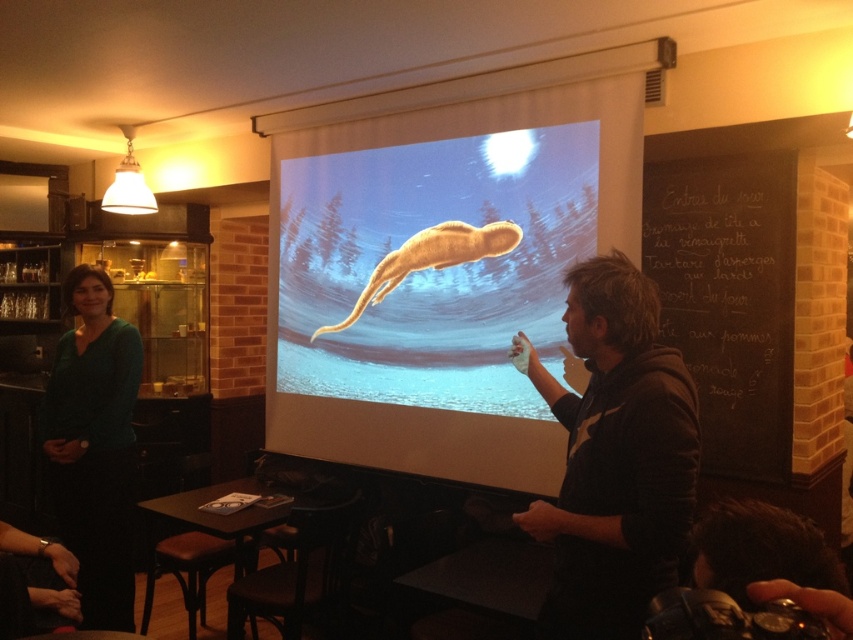
You are sitting in the front row of the presentation. The presenter is wearing a dark brown hoodie at center and pointing to a black chalkboard at upper right. Which object is closer to you?

The dark brown hoodie at center is closer to you because it is positioned to the left of the black chalkboard at upper right, which is further away.